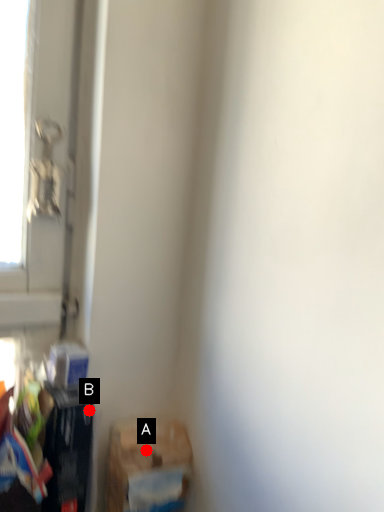
Question: Two points are circled on the image, labeled by A and B beside each circle. Which of the following is the closest to the observer?

Choices:
 (A) A is closer
 (B) B is closer

Answer: (B)